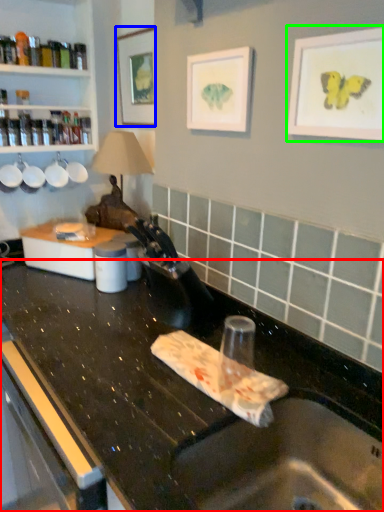
Question: Estimate the real-world distances between objects in this image. Which object is closer to countertop (highlighted by a red box), picture frame (highlighted by a blue box) or picture frame (highlighted by a green box)?

Choices:
 (A) picture frame
 (B) picture frame

Answer: (B)